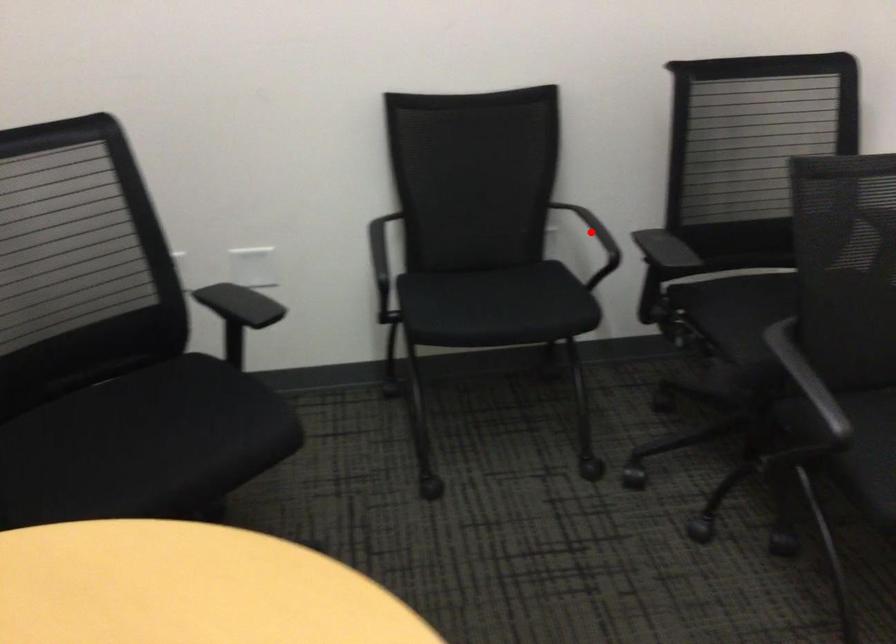
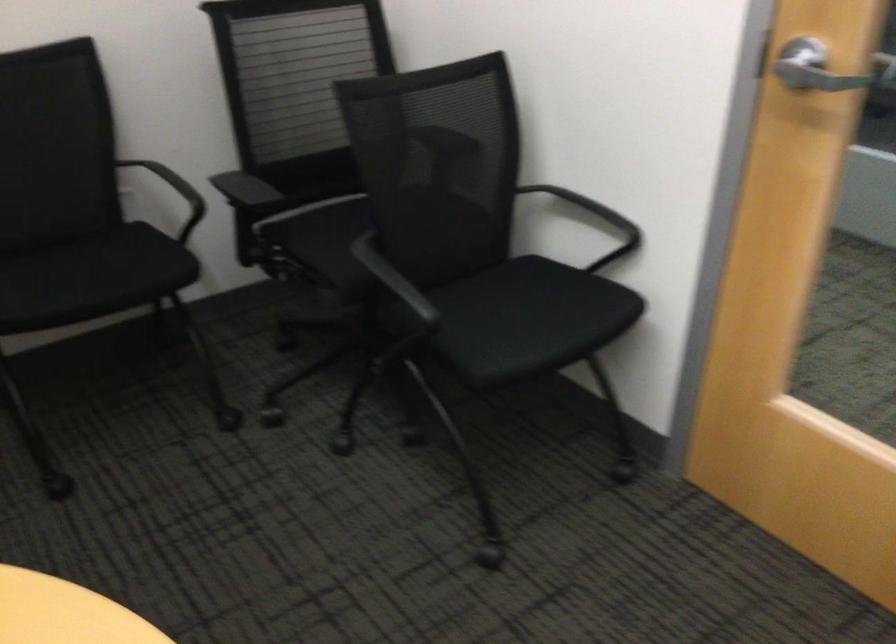
Where in the second image is the point corresponding to the highlighted location from the first image?

(174, 192)